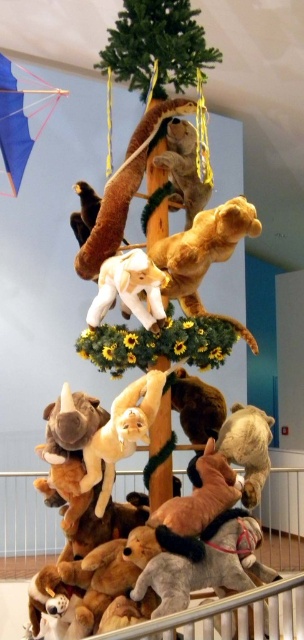
You are a child who wants to reach both the blue fabric kite at upper left and the white plush elephant at center from where you are standing. Which one is closer to you?

The white plush elephant at center is closer to you than the blue fabric kite at upper left since the distance between them is 7.11 feet.

You are a child trying to reach the stuffed animals in the scene. Which stuffed animal, the soft brown teddy bear at center or the fuzzy brown bear at upper center, is taller and easier to see from below?

The soft brown teddy bear at center is taller than the fuzzy brown bear at upper center, so it is easier to see from below.

You are a child who wants to reach the blue fabric kite at upper left from your current position. The kite is 3.61 meters away. If your maximum reaching distance is 2 meters, can you safely grab it without moving closer?

The blue fabric kite at upper left is 3.61 meters away, which is farther than your 2 meters maximum reaching distance. You cannot safely grab it without moving closer.